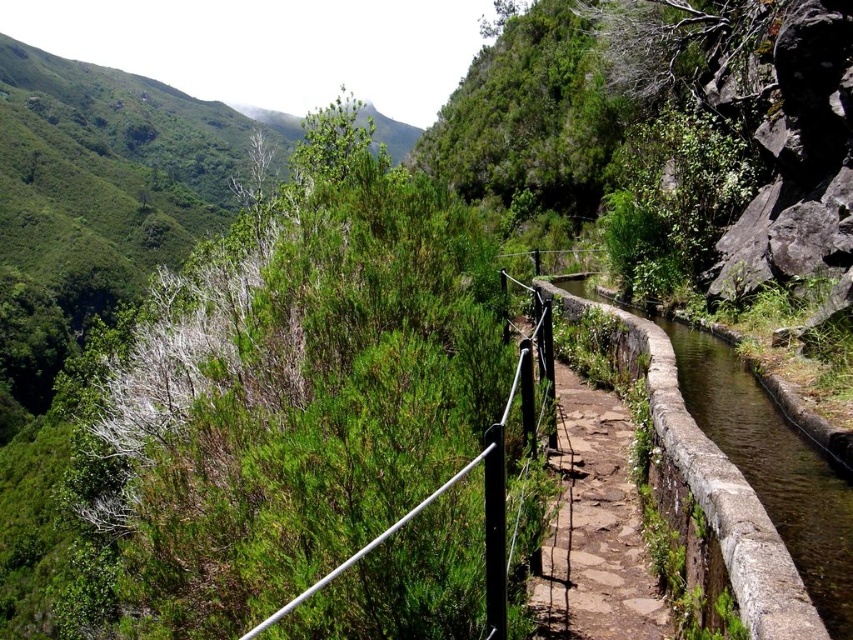
Is point (589, 522) closer to viewer compared to point (677, 344)?

Yes, it is in front of point (677, 344).

Is brown stone path at center wider than smooth stone canal at center?

No, brown stone path at center is not wider than smooth stone canal at center.

Describe the element at coordinates (595, 529) in the screenshot. I see `brown stone path at center` at that location.

Locate an element on the screen. The height and width of the screenshot is (640, 853). brown stone path at center is located at coordinates (595, 529).

Can you confirm if smooth stone canal at center is positioned below black metal rail at upper center?

Actually, smooth stone canal at center is above black metal rail at upper center.

Who is shorter, smooth stone canal at center or black metal rail at upper center?

smooth stone canal at center is shorter.

Does point (814, 547) come behind point (550, 396)?

No, it is in front of (550, 396).

Where is `smooth stone canal at center`? The image size is (853, 640). smooth stone canal at center is located at coordinates (773, 467).

Between brown stone path at center and black metal rail at upper center, which one appears on the right side from the viewer's perspective?

brown stone path at center is more to the right.

Identify the location of brown stone path at center. (595, 529).

Does point (613, 424) come behind point (498, 624)?

That is True.

The height and width of the screenshot is (640, 853). I want to click on brown stone path at center, so click(595, 529).